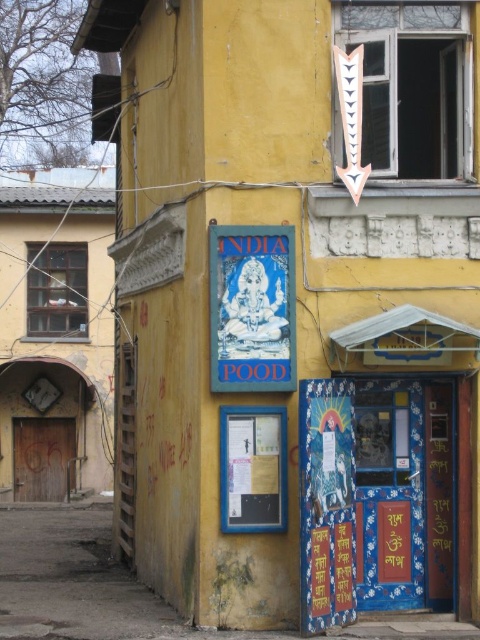
You are a delivery person with a 1.5 meter wide package. You need to enter the building through the wooden door at left or the blue paper poster at center. Which one can you use to deliver the package?

The wooden door at left is wider than the blue paper poster at center, so you can use the wooden door at left to deliver the package since it is wider than 1.5 meters.